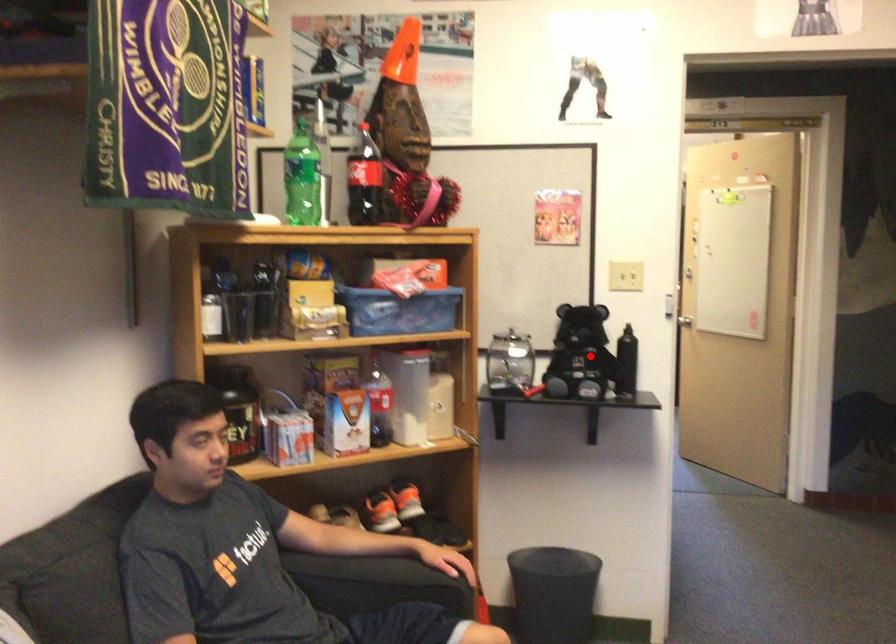
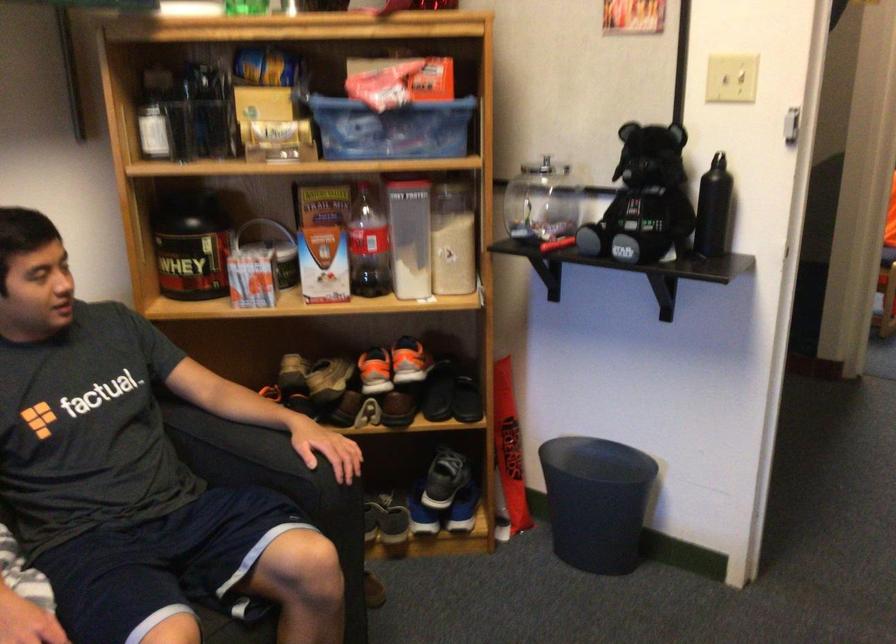
In the second image, find the point that corresponds to the highlighted location in the first image.

(643, 200)